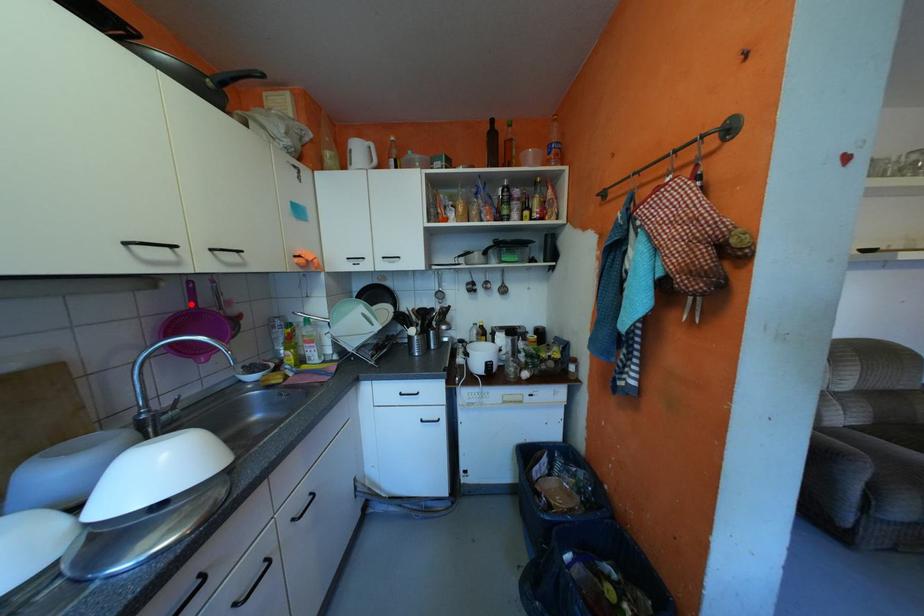
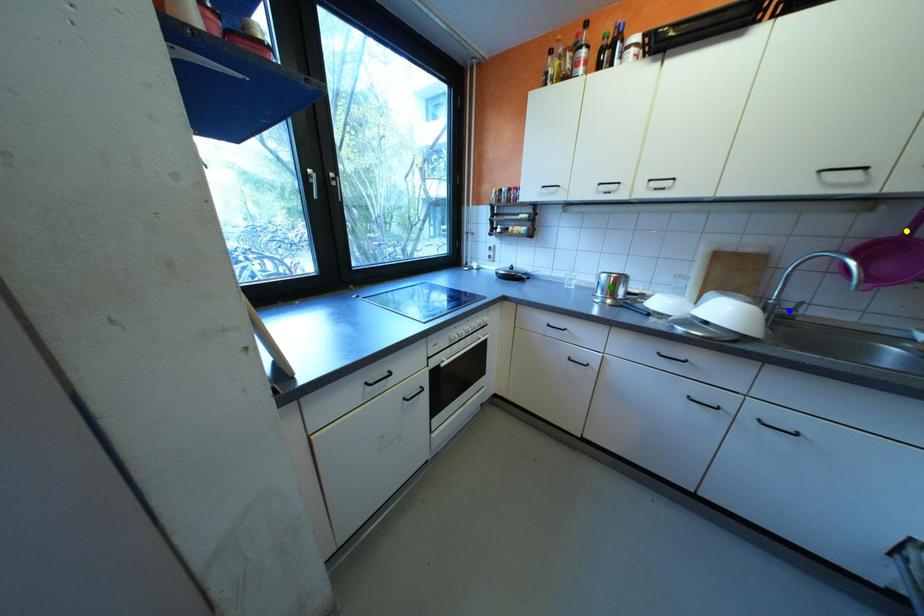
Question: I am providing you with two images of the same scene from different viewpoints. A red point is marked on the first image. You are given multiple points on the second image. Which mark in image 2 goes with the point in image 1?

Choices:
 (A) blue point
 (B) yellow point
 (C) green point

Answer: (B)